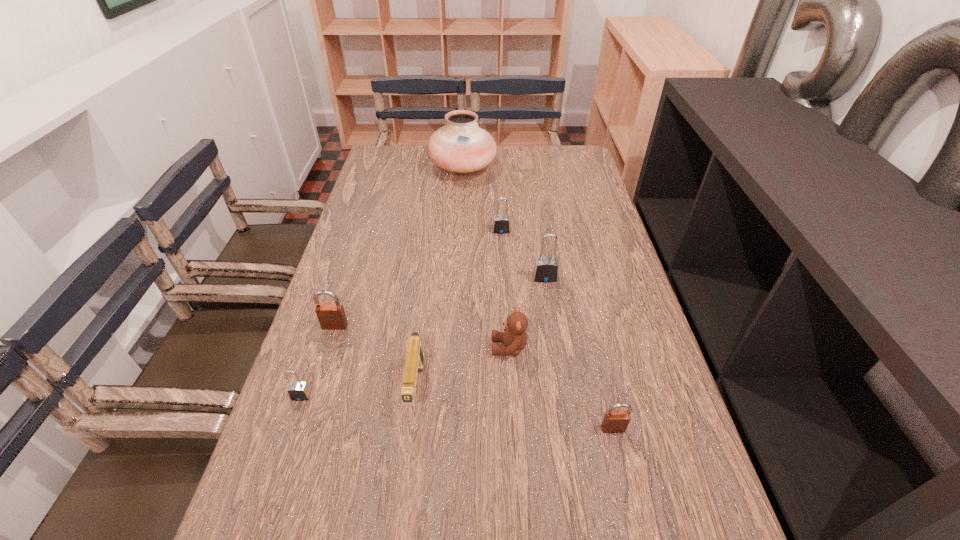
Where is `the farthest object`? the farthest object is located at coordinates (461, 146).

Identify the location of the tallest object. (461, 146).

Find the location of `the seventh object from left to right`. the seventh object from left to right is located at coordinates (545, 269).

Image resolution: width=960 pixels, height=540 pixels. In order to click on the tallest padlock in this screenshot , I will do `click(545, 269)`.

At what (x,y) coordinates should I click in order to perform the action: click on the farthest padlock. Please return your answer as a coordinate pair (x, y). This screenshot has width=960, height=540. Looking at the image, I should click on (501, 224).

Where is `the farthest gray padlock`? This screenshot has width=960, height=540. the farthest gray padlock is located at coordinates (501, 224).

The height and width of the screenshot is (540, 960). What are the coordinates of `the left brown padlock` in the screenshot? It's located at (331, 315).

This screenshot has height=540, width=960. In order to click on the bigger brown padlock in this screenshot , I will do `click(331, 315)`.

The height and width of the screenshot is (540, 960). What are the coordinates of `brown teddy bear` in the screenshot? It's located at (514, 336).

I want to click on tan pistol, so click(x=414, y=363).